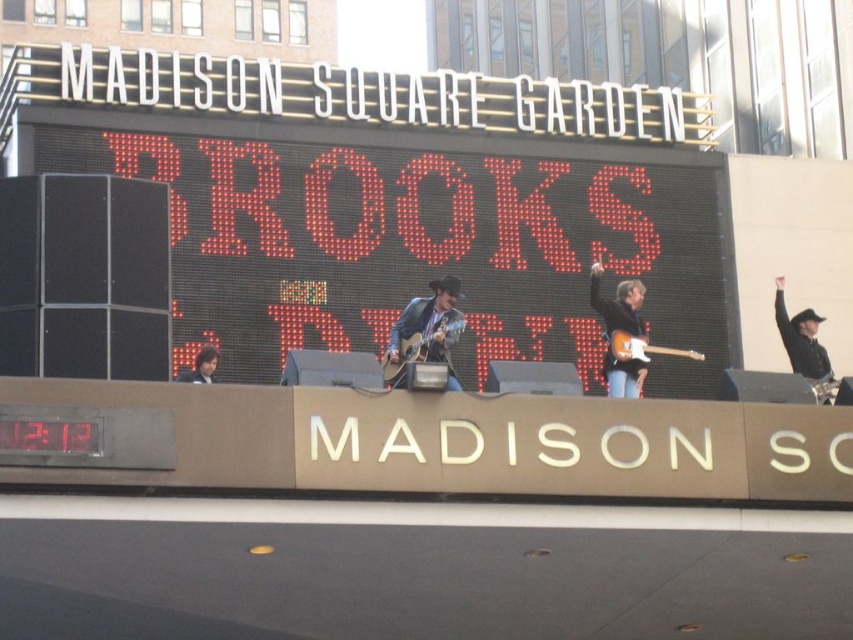
Is red led sign at center to the left of matte brown acoustic guitar at center from the viewer's perspective?

Yes, red led sign at center is to the left of matte brown acoustic guitar at center.

Can you confirm if red led sign at center is shorter than matte brown acoustic guitar at center?

Incorrect, red led sign at center's height does not fall short of matte brown acoustic guitar at center's.

The width and height of the screenshot is (853, 640). Describe the element at coordinates (398, 198) in the screenshot. I see `red led sign at center` at that location.

At what (x,y) coordinates should I click in order to perform the action: click on red led sign at center. Please return your answer as a coordinate pair (x, y). The image size is (853, 640). Looking at the image, I should click on (398, 198).

Who is positioned more to the left, red led sign at center or wooden electric guitar at center?

From the viewer's perspective, red led sign at center appears more on the left side.

From the picture: Between red led sign at center and wooden electric guitar at center, which one is positioned higher?

red led sign at center is above.

Is point (444, 205) positioned after point (654, 348)?

Yes, it is.

Locate an element on the screen. red led sign at center is located at coordinates (398, 198).

Can you confirm if glossy wood guitar at right is taller than matte brown acoustic guitar at center?

Yes, glossy wood guitar at right is taller than matte brown acoustic guitar at center.

Is point (605, 298) closer to camera compared to point (405, 360)?

No, (605, 298) is further to viewer.

Between point (618, 380) and point (387, 364), which one is positioned behind?

The point (618, 380) is more distant.

What are the coordinates of `glossy wood guitar at right` in the screenshot? It's located at point(621,330).